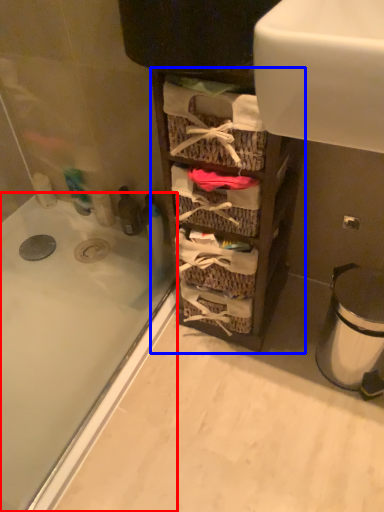
Question: Among these objects, which one is nearest to the camera, bathtub (highlighted by a red box) or cabinetry (highlighted by a blue box)?

Choices:
 (A) bathtub
 (B) cabinetry

Answer: (B)